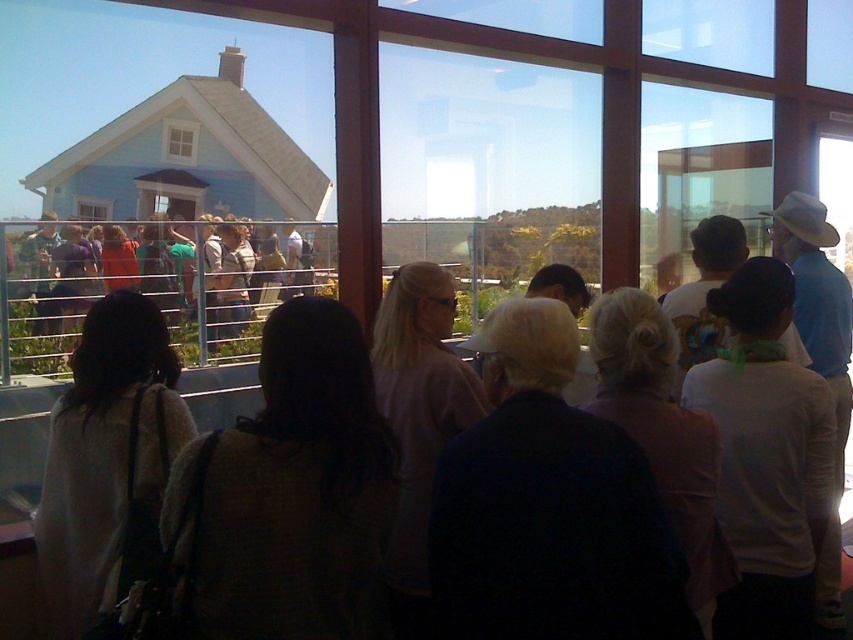
You are an architect designing a new building and want to ensure that the white wooden window at upper center and the transparent glass window at upper left provide adequate natural light. Based on their sizes, which window allows more light into the room?

The white wooden window at upper center is taller than the transparent glass window at upper left, so it allows more light into the room.